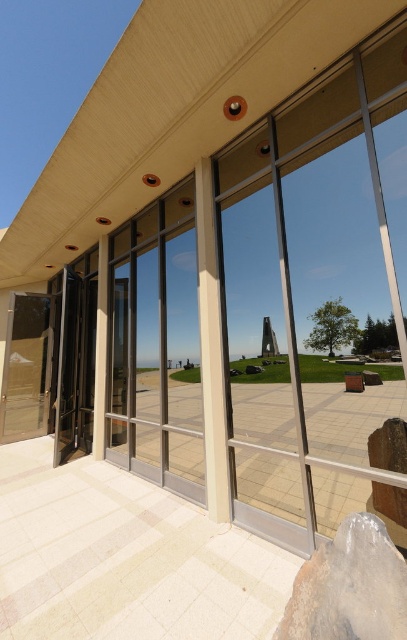
Question: Which is nearer to the black glass door at left?

Choices:
 (A) clear glass pillar at center
 (B) white glossy pillar at center

Answer: (B)

Question: Considering the relative positions of clear glass pillar at center and white glossy pillar at center in the image provided, where is clear glass pillar at center located with respect to white glossy pillar at center?

Choices:
 (A) above
 (B) below

Answer: (A)

Question: Observing the image, what is the correct spatial positioning of clear glass window at center in reference to white glossy pillar at center?

Choices:
 (A) left
 (B) right

Answer: (B)

Question: Estimate the real-world distances between objects in this image. Which object is farther from the white glossy pillar at center?

Choices:
 (A) black glass door at left
 (B) clear glass pillar at center

Answer: (B)

Question: Which object is farther from the camera taking this photo?

Choices:
 (A) clear glass window at center
 (B) black glass door at left
 (C) white glossy pillar at center
 (D) clear glass pillar at center

Answer: (C)

Question: Can you confirm if clear glass pillar at center is wider than black glass door at left?

Choices:
 (A) yes
 (B) no

Answer: (B)